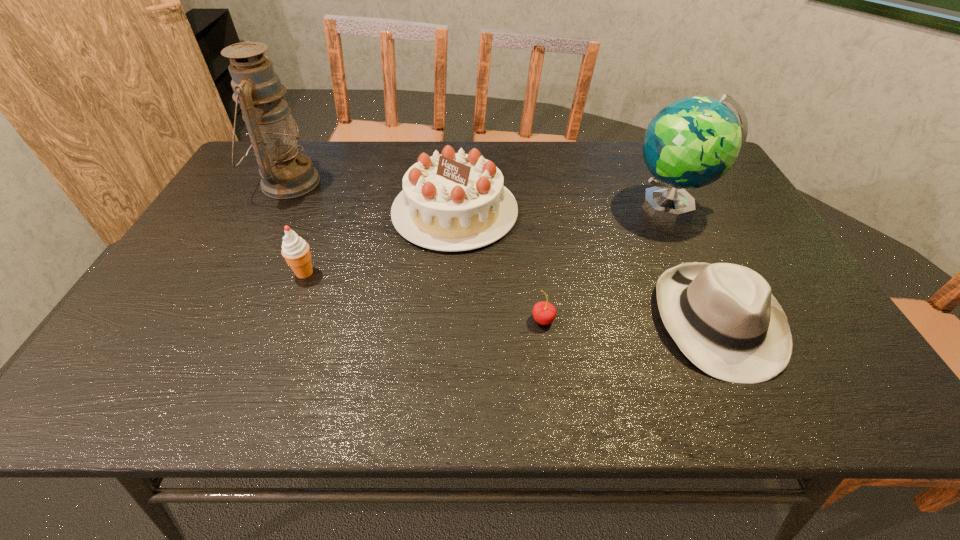
In order to click on globe that is at the right edge in this screenshot , I will do `click(692, 142)`.

You are a GUI agent. You are given a task and a screenshot of the screen. Output one action in this format:
    pyautogui.click(x=<x>, y=<y>)
    Task: Click on the fedora present at the right edge
    This screenshot has height=540, width=960.
    Given the screenshot: What is the action you would take?
    pyautogui.click(x=723, y=317)

Find the location of a particular element. The width and height of the screenshot is (960, 540). object situated at the far left corner is located at coordinates (285, 173).

Identify the location of object present at the near right corner. The width and height of the screenshot is (960, 540). pos(723,317).

Find the location of a particular element. The height and width of the screenshot is (540, 960). free space at the far edge of the desktop is located at coordinates (494, 152).

Find the location of `vacant space at the left edge of the desktop`. vacant space at the left edge of the desktop is located at coordinates (255, 221).

Identify the location of vacant region at the right edge of the desktop. (755, 233).

Where is `vacant area at the near left corner of the desktop`? vacant area at the near left corner of the desktop is located at coordinates (171, 375).

This screenshot has height=540, width=960. I want to click on vacant region between the fourth object from left to right and the fourth object from right to left, so (499, 266).

Find the location of a particular element. The height and width of the screenshot is (540, 960). free space that is in between the oil lamp and the fourth object from right to left is located at coordinates (372, 197).